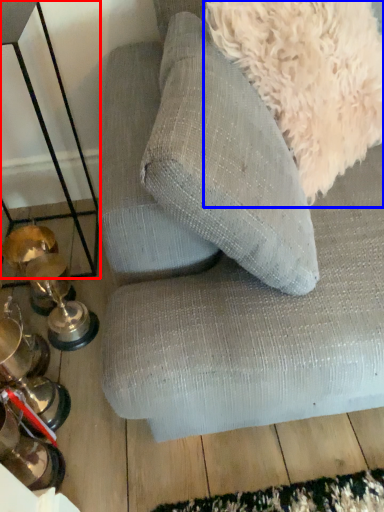
Question: Which object appears closest to the camera in this image, table (highlighted by a red box) or dog (highlighted by a blue box)?

Choices:
 (A) table
 (B) dog

Answer: (B)